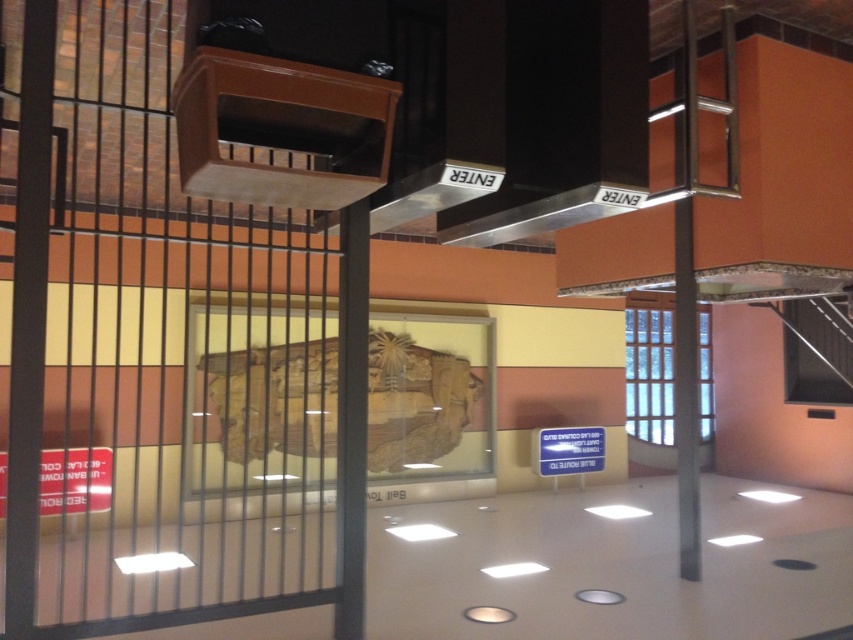
Between wooden carving at center and silver metallic exhaust hood at center, which one is positioned higher?

Positioned higher is silver metallic exhaust hood at center.

Who is more distant from viewer, [392,410] or [531,202]?

The point [392,410] is more distant.

This screenshot has width=853, height=640. I want to click on wooden carving at center, so click(x=276, y=397).

Which is more to the right, wooden slats at left or silver metallic exhaust hood at center?

Positioned to the right is silver metallic exhaust hood at center.

Does point (117, 172) come closer to viewer compared to point (508, 195)?

That is False.

Where is `wooden slats at left`? wooden slats at left is located at coordinates (183, 326).

Can you confirm if wooden slats at left is positioned to the left of wooden carving at center?

Yes, wooden slats at left is to the left of wooden carving at center.

This screenshot has width=853, height=640. What are the coordinates of `wooden slats at left` in the screenshot? It's located at pos(183,326).

Which is in front, point (67, 160) or point (323, 435)?

Point (67, 160) is in front.

Image resolution: width=853 pixels, height=640 pixels. I want to click on wooden slats at left, so click(183, 326).